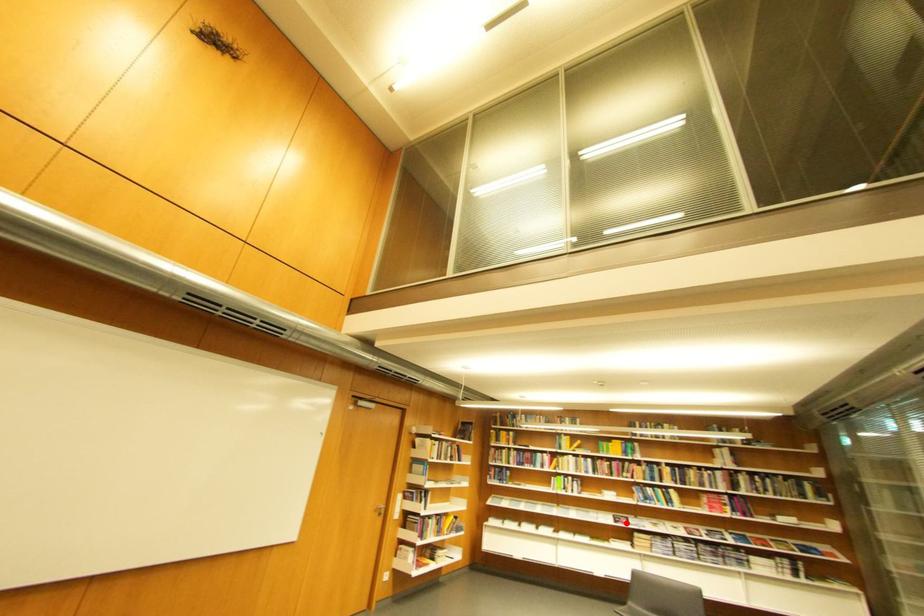
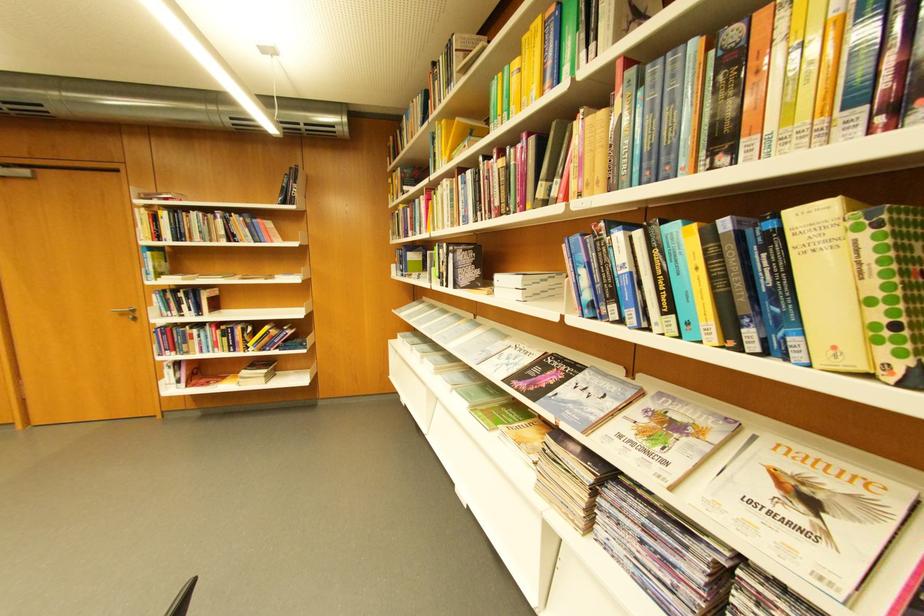
Locate, in the second image, the point that corresponds to the highlighted location in the first image.

(532, 377)